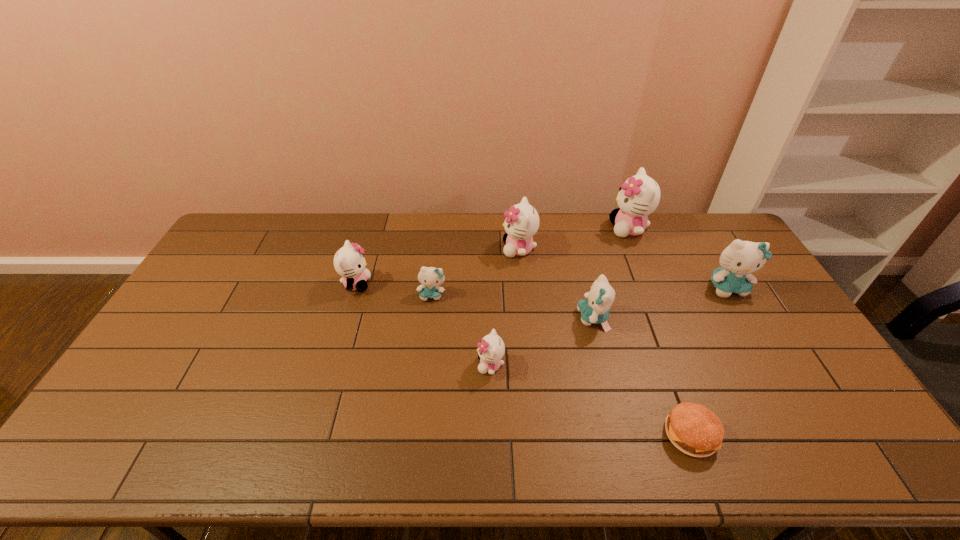
Identify the location of the biggest white kitten. (639, 196).

Where is `the second kitten from right to left`? the second kitten from right to left is located at coordinates (639, 196).

The height and width of the screenshot is (540, 960). I want to click on the fifth object from right to left, so pos(522,222).

Locate an element on the screen. The height and width of the screenshot is (540, 960). the second white kitten from right to left is located at coordinates (522, 222).

Identify the location of the rightmost object. Image resolution: width=960 pixels, height=540 pixels. (741, 258).

At what (x,y) coordinates should I click in order to perform the action: click on the biggest blue kitten. Please return your answer as a coordinate pair (x, y). Looking at the image, I should click on (741, 258).

Image resolution: width=960 pixels, height=540 pixels. What are the coordinates of `the second smallest blue kitten` in the screenshot? It's located at (595, 310).

Where is `the nearest blue kitten`? The height and width of the screenshot is (540, 960). the nearest blue kitten is located at coordinates (595, 310).

You are a GUI agent. You are given a task and a screenshot of the screen. Output one action in this format:
    pyautogui.click(x=<x>, y=<y>)
    Task: Click on the leftmost object
    The image size is (960, 540).
    Given the screenshot: What is the action you would take?
    pyautogui.click(x=349, y=263)

Where is `the leftmost kitten`? This screenshot has width=960, height=540. the leftmost kitten is located at coordinates tap(349, 263).